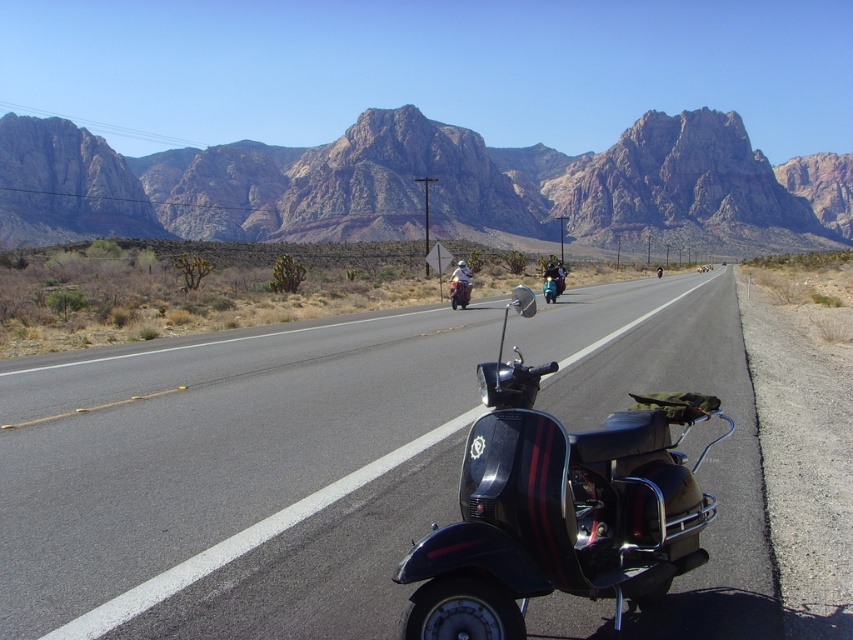
Question: Which object is positioned closest to the black matte scooter at center?

Choices:
 (A) black glossy scooter at center
 (B) matte black helmet at center
 (C) rugged rock formation at center

Answer: (A)

Question: Estimate the real-world distances between objects in this image. Which object is closer to the rugged rock formation at center?

Choices:
 (A) matte black scooter at center
 (B) black matte scooter at center
 (C) matte black helmet at center
 (D) white matte helmet at center

Answer: (C)

Question: Is black glossy scooter at center to the left of white matte helmet at center from the viewer's perspective?

Choices:
 (A) no
 (B) yes

Answer: (A)

Question: Does black glossy scooter at center appear under black matte scooter at center?

Choices:
 (A) no
 (B) yes

Answer: (A)

Question: Considering the real-world distances, which object is closest to the rugged rock formation at center?

Choices:
 (A) black matte scooter at center
 (B) white matte helmet at center
 (C) black glossy scooter at center
 (D) matte black helmet at center

Answer: (D)

Question: Does matte black scooter at center come behind white matte helmet at center?

Choices:
 (A) no
 (B) yes

Answer: (B)